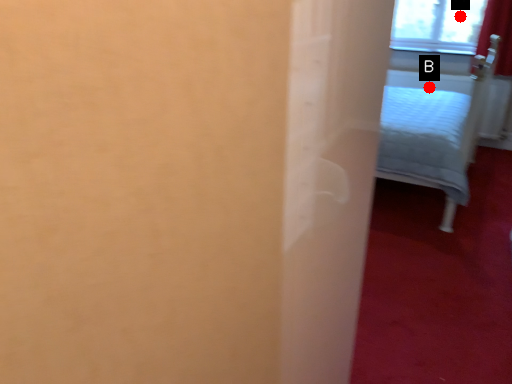
Question: Two points are circled on the image, labeled by A and B beside each circle. Which point appears farthest from the camera in this image?

Choices:
 (A) A is further
 (B) B is further

Answer: (B)